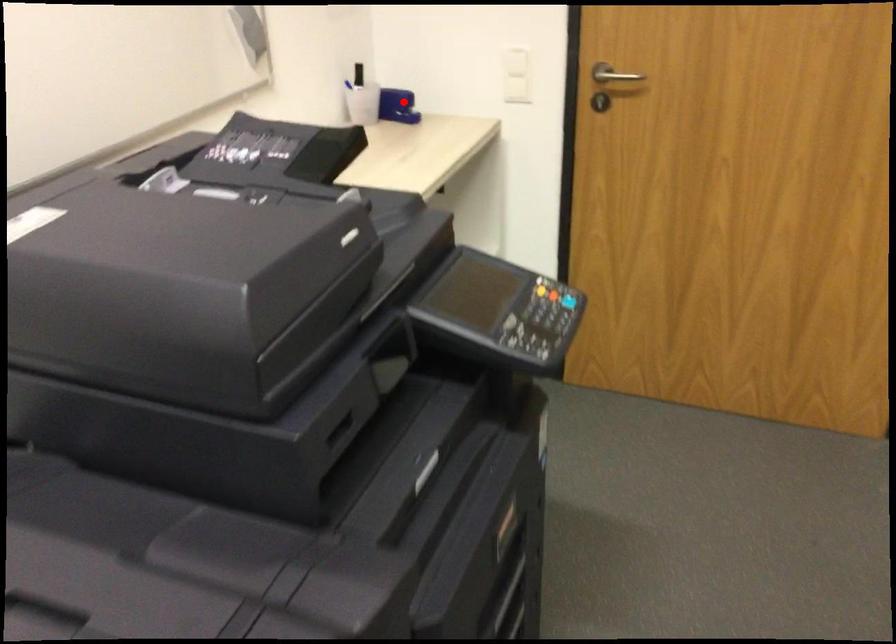
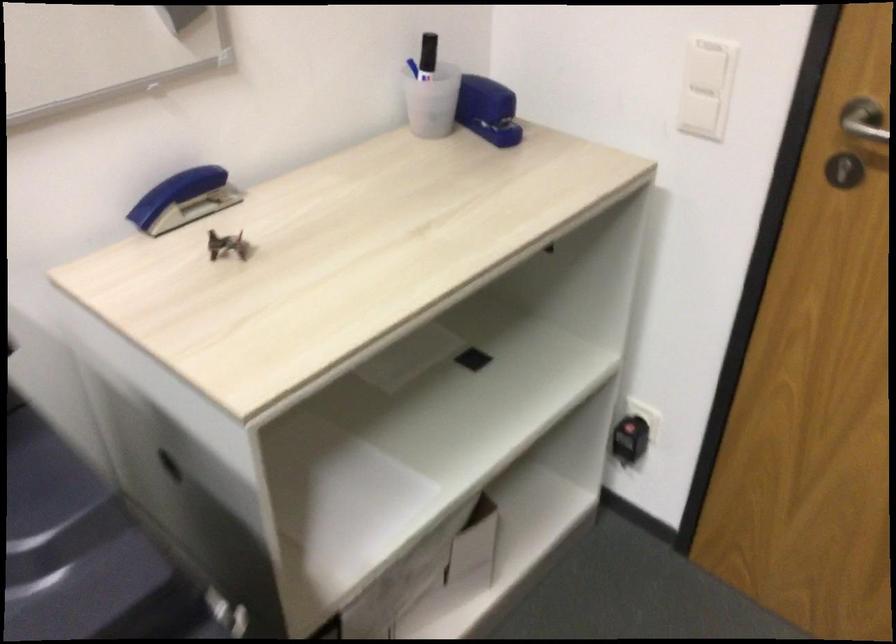
Find the pixel in the second image that matches the highlighted location in the first image.

(487, 109)